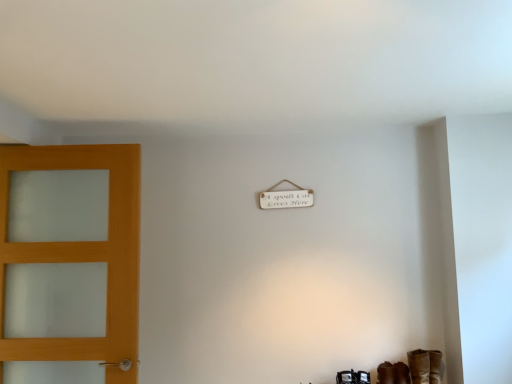
Question: Can you confirm if matte wood door at left is positioned to the left of brown leather shoe at lower right?

Choices:
 (A) yes
 (B) no

Answer: (A)

Question: From the image's perspective, is matte wood door at left beneath brown leather shoe at lower right?

Choices:
 (A) yes
 (B) no

Answer: (B)

Question: Is matte wood door at left oriented towards brown leather shoe at lower right?

Choices:
 (A) yes
 (B) no

Answer: (B)

Question: Is matte wood door at left far from brown leather shoe at lower right?

Choices:
 (A) yes
 (B) no

Answer: (A)

Question: From a real-world perspective, is matte wood door at left on brown leather shoe at lower right?

Choices:
 (A) yes
 (B) no

Answer: (A)

Question: Are matte wood door at left and brown leather shoe at lower right making contact?

Choices:
 (A) no
 (B) yes

Answer: (A)

Question: Can you confirm if brown leather shoe at lower right is positioned to the left of brown leather boot at lower right?

Choices:
 (A) no
 (B) yes

Answer: (B)

Question: From the image's perspective, would you say brown leather shoe at lower right is positioned over brown leather boot at lower right?

Choices:
 (A) yes
 (B) no

Answer: (B)

Question: From the image's perspective, would you say brown leather shoe at lower right is shown under brown leather boot at lower right?

Choices:
 (A) yes
 (B) no

Answer: (A)

Question: From a real-world perspective, is brown leather shoe at lower right under brown leather boot at lower right?

Choices:
 (A) yes
 (B) no

Answer: (A)

Question: Can you see brown leather shoe at lower right touching brown leather boot at lower right?

Choices:
 (A) no
 (B) yes

Answer: (A)

Question: Considering the relative sizes of brown leather shoe at lower right and brown leather boot at lower right in the image provided, is brown leather shoe at lower right bigger than brown leather boot at lower right?

Choices:
 (A) yes
 (B) no

Answer: (B)

Question: Is brown leather boot at lower right bigger than brown leather shoe at lower right?

Choices:
 (A) yes
 (B) no

Answer: (A)